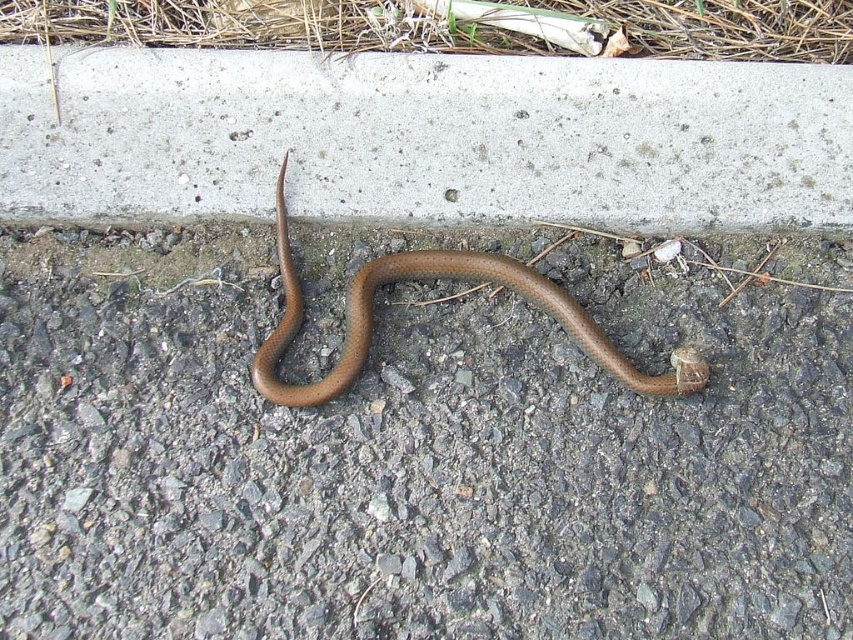
You are a gardener who needs to place a new potted plant between the brown rubber snake at lower center and the green grass at upper center. Based on their positions, where should the potted plant be placed?

The brown rubber snake at lower center is in front of the green grass at upper center, so the potted plant should be placed between them, closer to the green grass at upper center to maintain the spatial arrangement.

You are standing on the concrete curb looking down at the brown matte snake at center. Can you see the green grass at upper center from your position?

Yes, because the green grass at upper center is above the brown matte snake at center, so it should be visible from the concrete curb.

You are a gardener who needs to mow the lawn. You see the green grass at upper center and the brown matte snake at center. Which area should you avoid mowing to prevent harming the snake?

You should avoid mowing the area with the brown matte snake at center because the green grass at upper center is shorter than the brown matte snake at center, so the snake is likely closer to the ground and could be harmed by the mower.